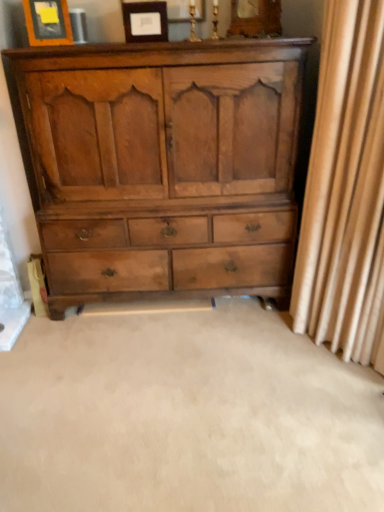
Question: From a real-world perspective, is light brown wood chest of drawers at center on beige fabric curtain at right?

Choices:
 (A) yes
 (B) no

Answer: (B)

Question: From the image's perspective, would you say light brown wood chest of drawers at center is shown under beige fabric curtain at right?

Choices:
 (A) no
 (B) yes

Answer: (A)

Question: Is light brown wood chest of drawers at center in contact with beige fabric curtain at right?

Choices:
 (A) yes
 (B) no

Answer: (B)

Question: From the image's perspective, is light brown wood chest of drawers at center on top of beige fabric curtain at right?

Choices:
 (A) yes
 (B) no

Answer: (A)

Question: Could you tell me if light brown wood chest of drawers at center is turned towards beige fabric curtain at right?

Choices:
 (A) no
 (B) yes

Answer: (A)

Question: Is light brown wood chest of drawers at center turned away from beige fabric curtain at right?

Choices:
 (A) yes
 (B) no

Answer: (B)

Question: Can you confirm if beige fabric curtain at right is thinner than light brown wood chest of drawers at center?

Choices:
 (A) no
 (B) yes

Answer: (B)

Question: Could you tell me if beige fabric curtain at right is turned towards light brown wood chest of drawers at center?

Choices:
 (A) yes
 (B) no

Answer: (B)

Question: Can you confirm if beige fabric curtain at right is wider than light brown wood chest of drawers at center?

Choices:
 (A) yes
 (B) no

Answer: (B)

Question: From a real-world perspective, is beige fabric curtain at right positioned over light brown wood chest of drawers at center based on gravity?

Choices:
 (A) yes
 (B) no

Answer: (A)

Question: Can you confirm if beige fabric curtain at right is smaller than light brown wood chest of drawers at center?

Choices:
 (A) yes
 (B) no

Answer: (A)

Question: Considering the relative sizes of beige fabric curtain at right and light brown wood chest of drawers at center in the image provided, is beige fabric curtain at right shorter than light brown wood chest of drawers at center?

Choices:
 (A) yes
 (B) no

Answer: (B)

Question: Can we say matte wood picture frame at upper center, placed as the 1th picture frame when sorted from right to left, lies outside beige fabric curtain at right?

Choices:
 (A) yes
 (B) no

Answer: (A)